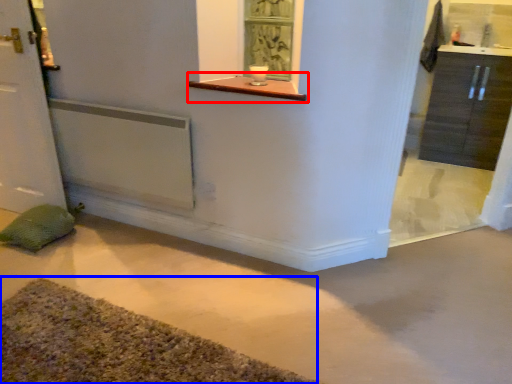
Question: Which object appears farthest to the camera in this image, window sill (highlighted by a red box) or bath mat (highlighted by a blue box)?

Choices:
 (A) window sill
 (B) bath mat

Answer: (A)